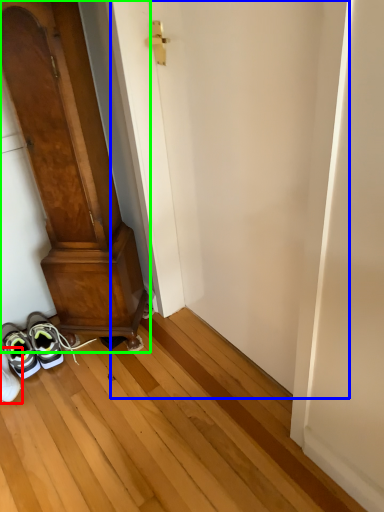
Question: Based on their relative distances, which object is nearer to footwear (highlighted by a red box)? Choose from door (highlighted by a blue box) and door (highlighted by a green box).

Choices:
 (A) door
 (B) door

Answer: (B)